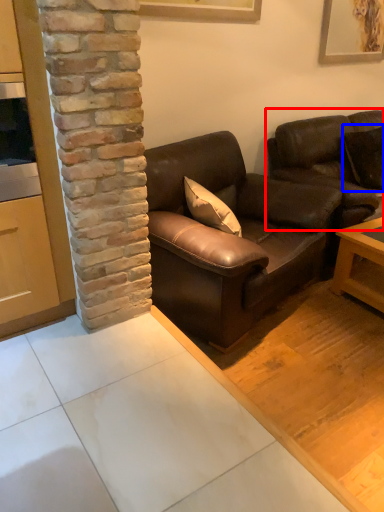
Question: Among these objects, which one is nearest to the camera, studio couch (highlighted by a red box) or pillow (highlighted by a blue box)?

Choices:
 (A) studio couch
 (B) pillow

Answer: (A)